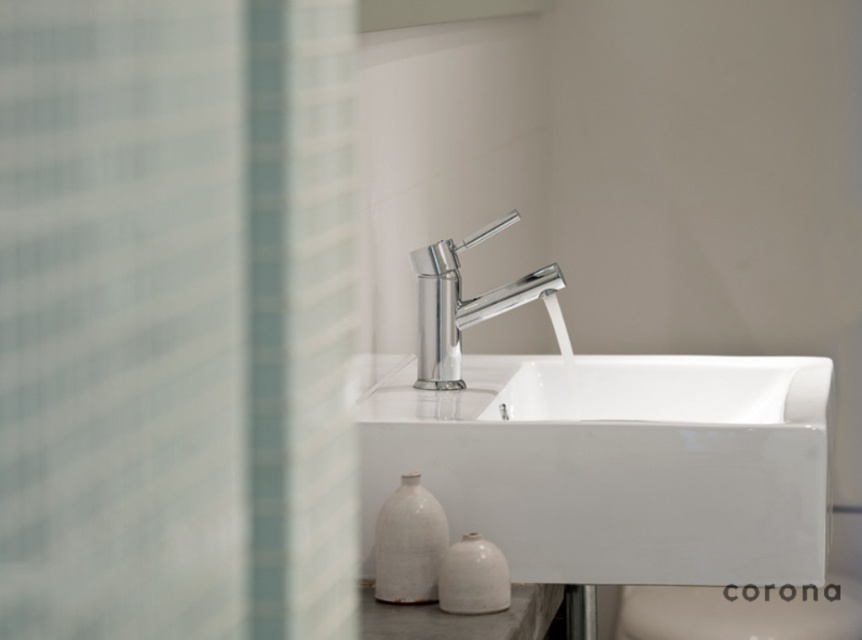
From the picture: Can you confirm if white ceramic toilet bowl at center is smaller than white matte vase at lower left?

Incorrect, white ceramic toilet bowl at center is not smaller in size than white matte vase at lower left.

Who is more distant from viewer, [748,600] or [403,534]?

The point [748,600] is more distant.

This screenshot has height=640, width=862. Find the location of `white ceramic toilet bowl at center`. white ceramic toilet bowl at center is located at coordinates (741, 611).

Which is behind, point (671, 536) or point (453, 330)?

Point (453, 330)

Can you confirm if white ceramic sink at center is positioned to the left of chrome/metallic faucet at center?

In fact, white ceramic sink at center is to the right of chrome/metallic faucet at center.

Is point (417, 289) positioned in front of point (415, 259)?

No.

Where is `white ceramic sink at center`? The image size is (862, 640). white ceramic sink at center is located at coordinates (598, 449).

Who is shorter, white ceramic sink at center or white matte vase at lower left?

white matte vase at lower left

Is white ceramic sink at center thinner than white matte vase at lower left?

Incorrect, white ceramic sink at center's width is not less than white matte vase at lower left's.

Which is behind, point (448, 464) or point (380, 573)?

The point (448, 464) is more distant.

Locate an element on the screen. Image resolution: width=862 pixels, height=640 pixels. white ceramic sink at center is located at coordinates (598, 449).